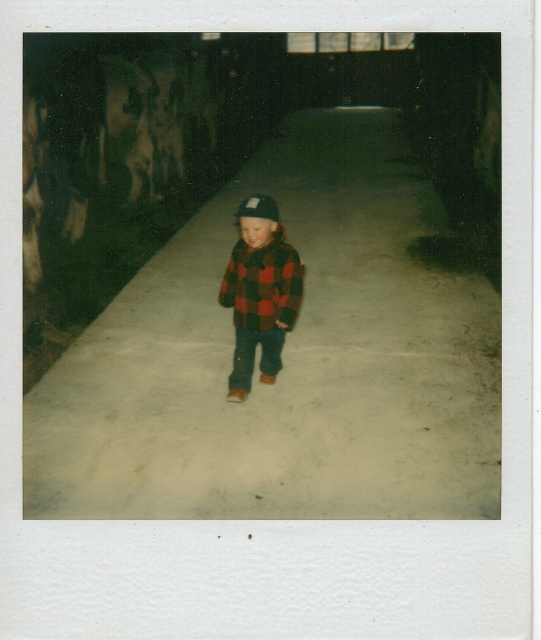
Does flannel plaid jacket at center have a greater height compared to plaid wool jacket at center?

Yes.

Is point (280, 292) behind point (234, 292)?

That is False.

Identify the location of flannel plaid jacket at center. (260, 292).

Between white concrete pavement at center and black felt hat at center, which one is positioned lower?

black felt hat at center is below.

The image size is (541, 640). What are the coordinates of `white concrete pavement at center` in the screenshot? It's located at (286, 358).

Does point (254, 312) come in front of point (254, 216)?

That is False.

Is plaid wool jacket at center shorter than black felt hat at center?

No, plaid wool jacket at center is not shorter than black felt hat at center.

Where is `plaid wool jacket at center`? plaid wool jacket at center is located at coordinates (263, 284).

Identify the location of plaid wool jacket at center. Image resolution: width=541 pixels, height=640 pixels. (263, 284).